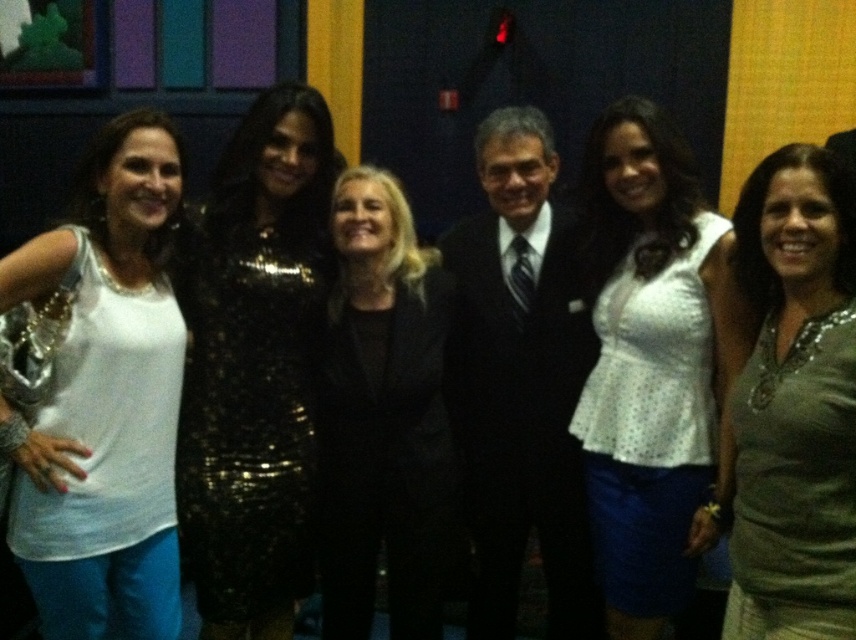
Is white sequined dress at left taller than black sequined dress at center?

Yes.

Does white sequined dress at left appear on the left side of black sequined dress at center?

Yes, white sequined dress at left is to the left of black sequined dress at center.

The width and height of the screenshot is (856, 640). What do you see at coordinates (107, 397) in the screenshot? I see `white sequined dress at left` at bounding box center [107, 397].

Where is `white sequined dress at left`? The width and height of the screenshot is (856, 640). white sequined dress at left is located at coordinates (107, 397).

Is black sequined dress at center smaller than white dotted fabric dress at center?

Incorrect, black sequined dress at center is not smaller in size than white dotted fabric dress at center.

Consider the image. Who is more distant from viewer, (327, 362) or (678, 432)?

Point (327, 362)

I want to click on black sequined dress at center, so (x=382, y=419).

Is white dotted blouse at center further to the viewer compared to white dotted fabric dress at center?

That is False.

Does white dotted blouse at center have a greater width compared to white dotted fabric dress at center?

Indeed, white dotted blouse at center has a greater width compared to white dotted fabric dress at center.

Locate an element on the screen. white dotted blouse at center is located at coordinates (654, 365).

Where is `white dotted blouse at center`? The image size is (856, 640). white dotted blouse at center is located at coordinates (654, 365).